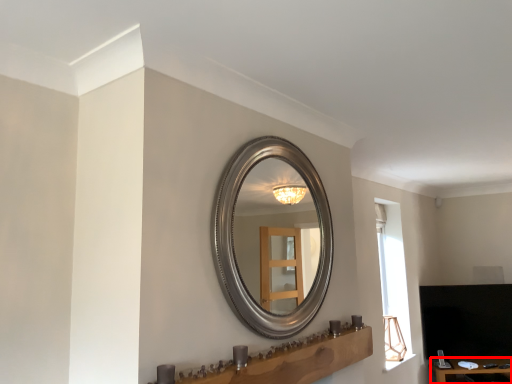
Question: From the image's perspective, where is table (annotated by the red box) located in relation to vanity in the image?

Choices:
 (A) above
 (B) below

Answer: (B)